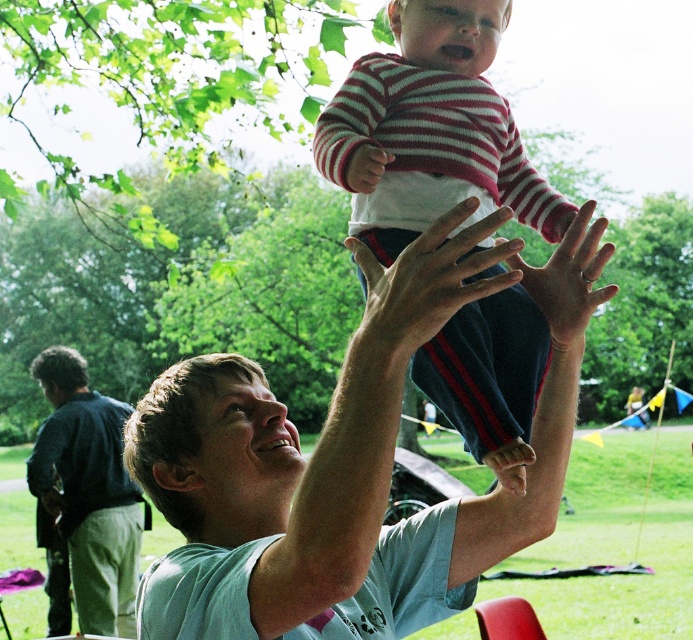
Question: Is light blue t-shirt at center positioned at the back of striped cotton shirt at center?

Choices:
 (A) yes
 (B) no

Answer: (B)

Question: In this image, where is light blue t-shirt at center located relative to dark blue jeans at lower left?

Choices:
 (A) above
 (B) below

Answer: (A)

Question: Considering the real-world distances, which object is closest to the dark blue jeans at lower left?

Choices:
 (A) striped cotton shirt at center
 (B) light blue t-shirt at center

Answer: (B)

Question: Which object is closer to the camera taking this photo?

Choices:
 (A) striped cotton shirt at center
 (B) dark blue jeans at lower left

Answer: (A)

Question: Among these points, which one is farthest from the camera?

Choices:
 (A) (67, 387)
 (B) (412, 348)

Answer: (A)

Question: In this image, where is light blue t-shirt at center located relative to dark blue jeans at lower left?

Choices:
 (A) above
 (B) below

Answer: (A)